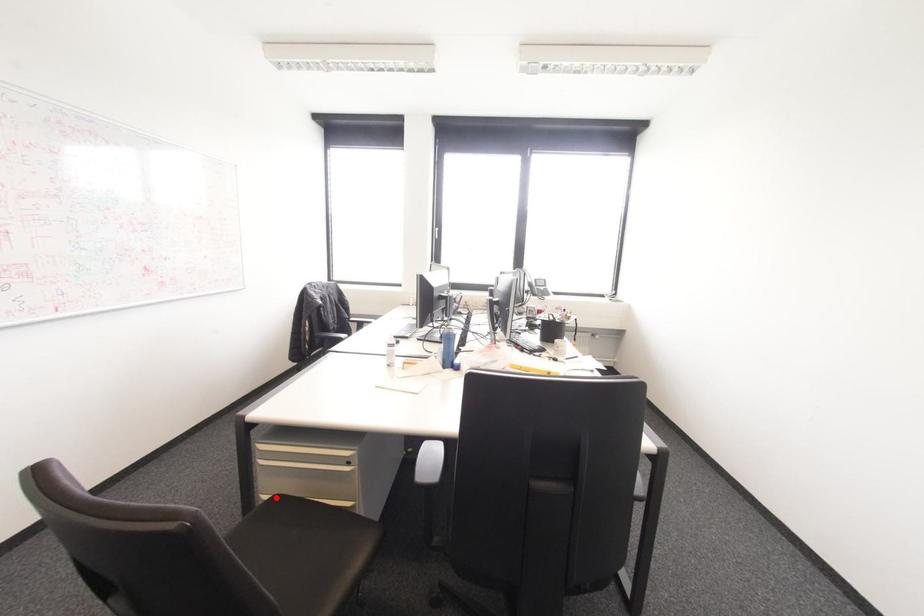
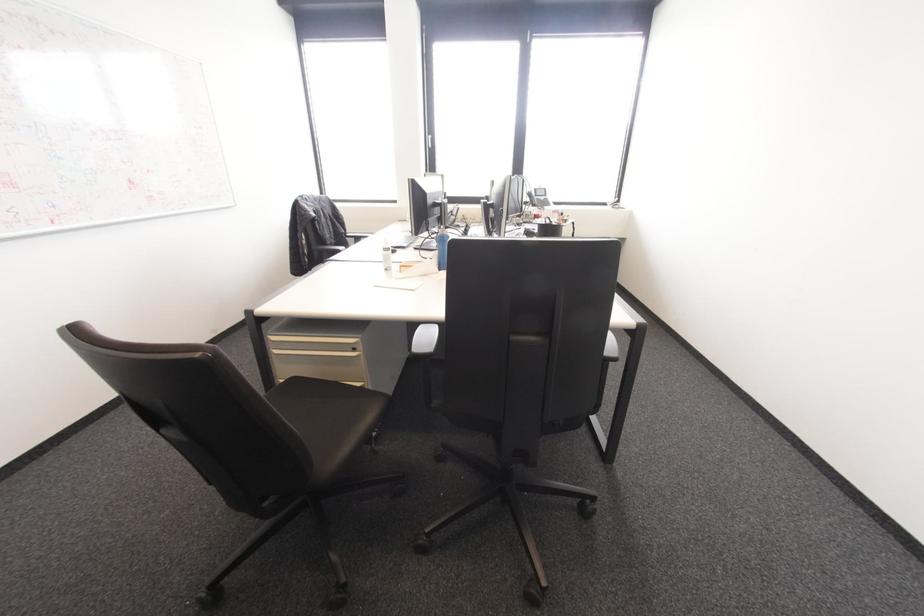
Question: I am providing you with two images of the same scene from different viewpoints. A red point is shown in image1. For the corresponding object point in image2, is it positioned nearer or farther from the camera?

Choices:
 (A) Nearer
 (B) Farther

Answer: (B)